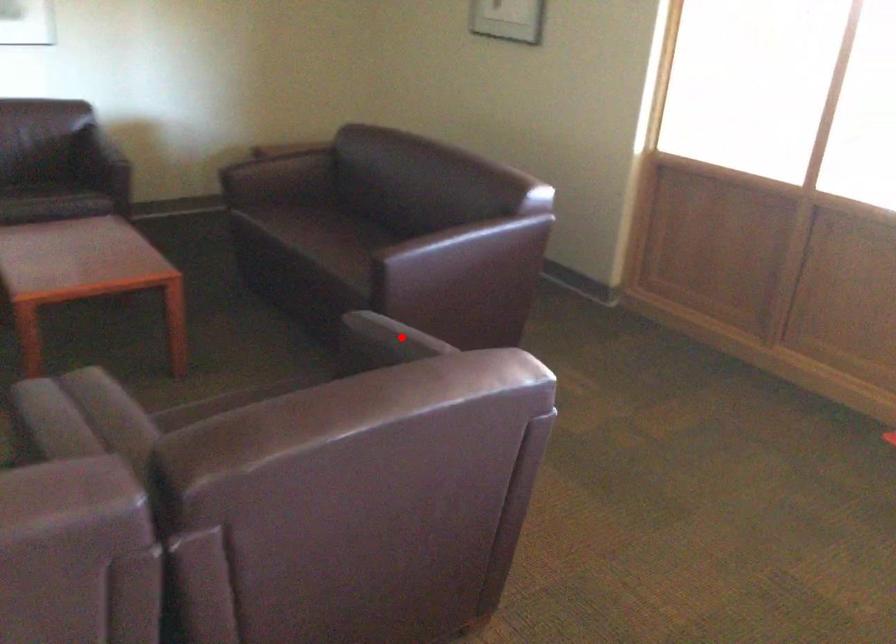
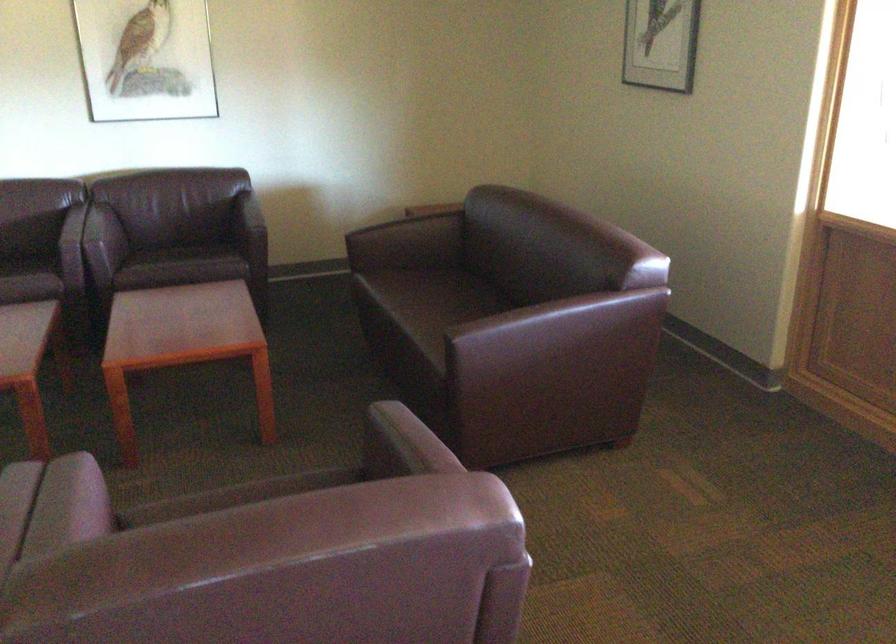
Question: I am providing you with two images of the same scene from different viewpoints. A red point is marked on the first image. Can you still see the location of the red point in image 2?

Choices:
 (A) Yes
 (B) No

Answer: (A)